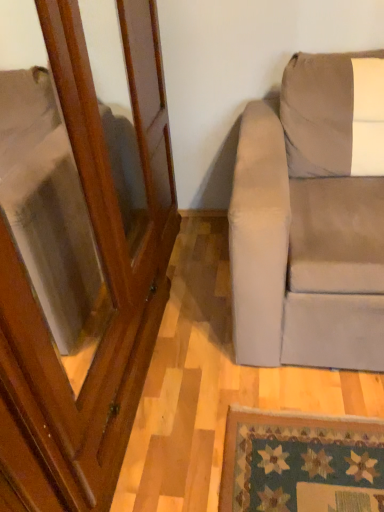
Question: From a real-world perspective, is wooden screen door at left located higher than suede beige couch at right?

Choices:
 (A) no
 (B) yes

Answer: (B)

Question: Can you confirm if wooden screen door at left is shorter than suede beige couch at right?

Choices:
 (A) yes
 (B) no

Answer: (B)

Question: Is wooden screen door at left to the right of suede beige couch at right from the viewer's perspective?

Choices:
 (A) yes
 (B) no

Answer: (B)

Question: Is wooden screen door at left wider than suede beige couch at right?

Choices:
 (A) yes
 (B) no

Answer: (B)

Question: Does wooden screen door at left touch suede beige couch at right?

Choices:
 (A) no
 (B) yes

Answer: (A)

Question: Could you tell me if wooden screen door at left is facing suede beige couch at right?

Choices:
 (A) yes
 (B) no

Answer: (A)

Question: Would you say suede beige couch at right is a long distance from wooden screen door at left?

Choices:
 (A) no
 (B) yes

Answer: (A)

Question: Is suede beige couch at right aimed at wooden screen door at left?

Choices:
 (A) no
 (B) yes

Answer: (A)

Question: Does suede beige couch at right have a smaller size compared to wooden screen door at left?

Choices:
 (A) yes
 (B) no

Answer: (A)

Question: From the image's perspective, is suede beige couch at right under wooden screen door at left?

Choices:
 (A) no
 (B) yes

Answer: (A)

Question: Can you confirm if suede beige couch at right is thinner than wooden screen door at left?

Choices:
 (A) yes
 (B) no

Answer: (B)

Question: From the image's perspective, is suede beige couch at right located above wooden screen door at left?

Choices:
 (A) no
 (B) yes

Answer: (B)

Question: In the image, is wooden screen door at left positioned in front of or behind suede beige couch at right?

Choices:
 (A) front
 (B) behind

Answer: (A)